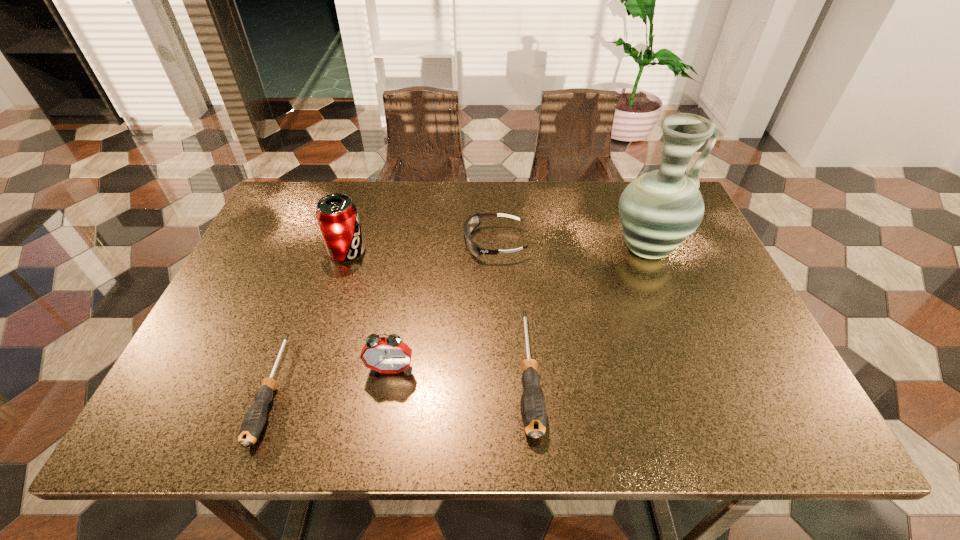
At what (x,y) coordinates should I click in order to perform the action: click on vacant region between the fourth shortest object and the rightmost object. Please return your answer as a coordinate pair (x, y). Looking at the image, I should click on (518, 309).

Find the location of `vacant area that lies between the third shortest object and the soda can`. vacant area that lies between the third shortest object and the soda can is located at coordinates (421, 247).

At what (x,y) coordinates should I click in order to perform the action: click on vacant space that is in between the shorter screwdriver and the third shortest object. Please return your answer as a coordinate pair (x, y). Looking at the image, I should click on (x=383, y=316).

This screenshot has width=960, height=540. Identify the location of free point between the fifth tallest object and the shorter screwdriver. click(x=400, y=381).

Image resolution: width=960 pixels, height=540 pixels. I want to click on object that is the third closest one to the fifth shortest object, so click(390, 354).

Identify which object is the closest to the alarm clock. Please provide its 2D coordinates. Your answer should be formatted as a tuple, i.e. [(x, y)], where the tuple contains the x and y coordinates of a point satisfying the conditions above.

[(252, 425)]

Where is `vacant area that satisfies the following two spatial constraints: 1. on the front and sides of the third shortest object; 2. on the left side of the right screwdriver`? This screenshot has height=540, width=960. vacant area that satisfies the following two spatial constraints: 1. on the front and sides of the third shortest object; 2. on the left side of the right screwdriver is located at coordinates (499, 373).

Where is `free location that satisfies the following two spatial constraints: 1. on the clock face of the taller screwdriver; 2. on the left side of the fourth object from right to left`? free location that satisfies the following two spatial constraints: 1. on the clock face of the taller screwdriver; 2. on the left side of the fourth object from right to left is located at coordinates (391, 373).